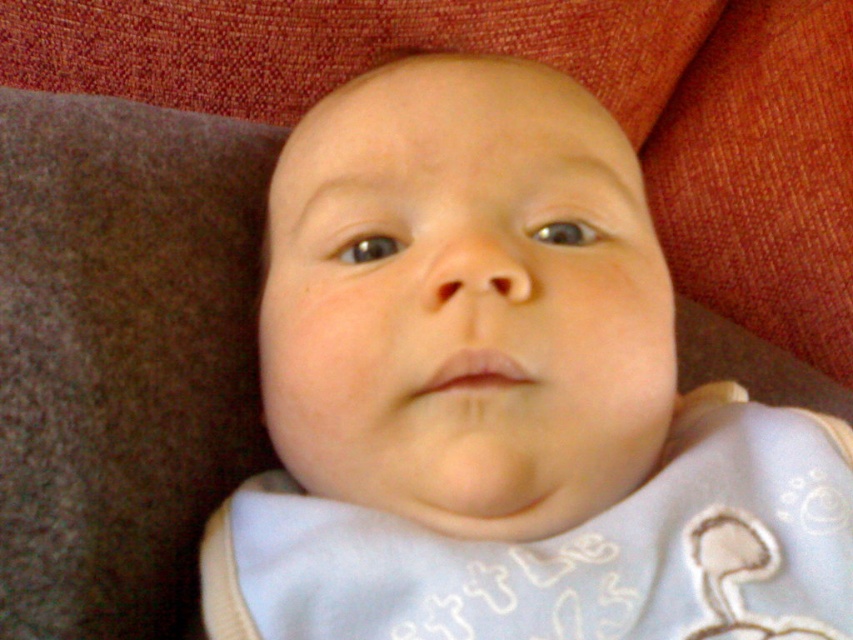
You are a parent holding a smooth white bib at center and a soft cotton blanket at upper center. You want to place them on a shelf that can only hold items within 18 inches of each other. Can you fit both items on the shelf without moving them closer?

The smooth white bib at center and the soft cotton blanket at upper center are 19.80 inches apart, which exceeds the shelf capacity of 18 inches. Therefore, they cannot be placed on the shelf without moving them closer.

You are a photographer trying to capture the baby in the image. You notice two points marked as point (512, 353) and point (780, 189). Which point is nearer to the camera?

Point (512, 353) is closer to the camera than point (780, 189).

You are a photographer setting up for a baby photoshoot. You have a soft cotton blanket at upper center and a light blue fabric bib at center. Which item is wider when viewed from above?

The soft cotton blanket at upper center is wider than the light blue fabric bib at center.